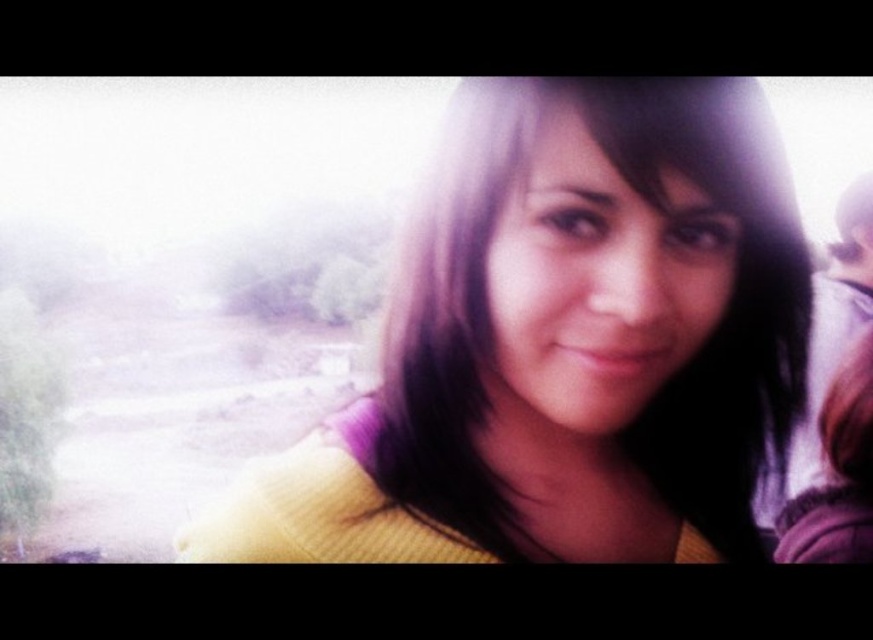
Question: Which of the following is the farthest from the observer?

Choices:
 (A) (303, 493)
 (B) (853, 339)

Answer: (B)

Question: Does yellow knitted sweater at center have a greater width compared to smooth purple sweater at right?

Choices:
 (A) no
 (B) yes

Answer: (A)

Question: Is yellow knitted sweater at center above smooth purple sweater at right?

Choices:
 (A) yes
 (B) no

Answer: (B)

Question: Is yellow knitted sweater at center closer to the viewer compared to smooth purple sweater at right?

Choices:
 (A) yes
 (B) no

Answer: (A)